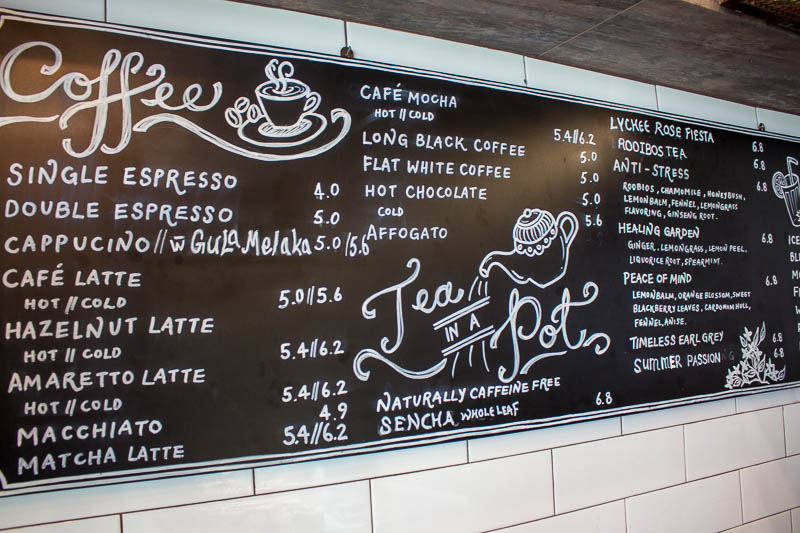
Where is `hook`? The image size is (800, 533). hook is located at coordinates 354,51, 773,126.